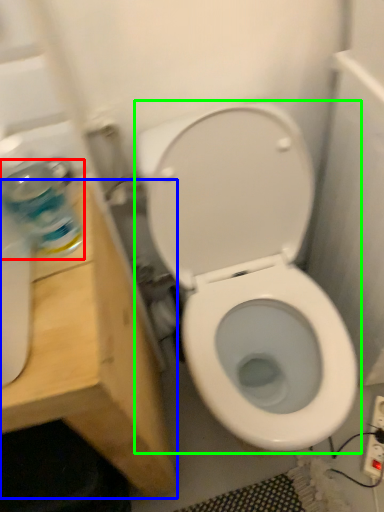
Question: Considering the real-world distances, which object is closest to cleaning product (highlighted by a red box)? vanity (highlighted by a blue box) or toilet (highlighted by a green box).

Choices:
 (A) vanity
 (B) toilet

Answer: (A)